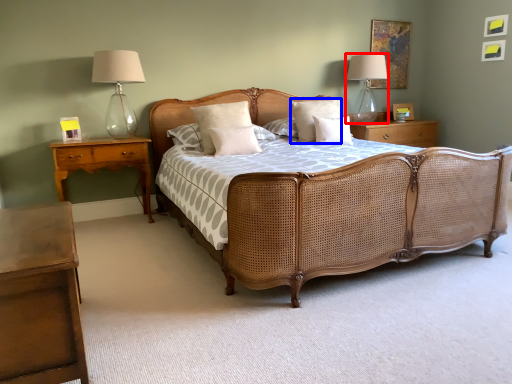
Question: Which object appears closest to the camera in this image, bedside lamp (highlighted by a red box) or pillow (highlighted by a blue box)?

Choices:
 (A) bedside lamp
 (B) pillow

Answer: (B)